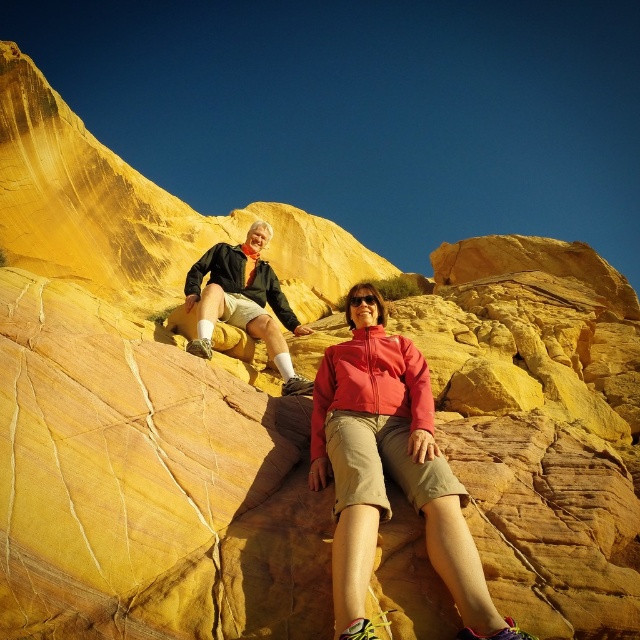
Does matte pink jacket at center lie behind matte black jacket at upper left?

No.

Find the location of a particular element. matte pink jacket at center is located at coordinates (388, 467).